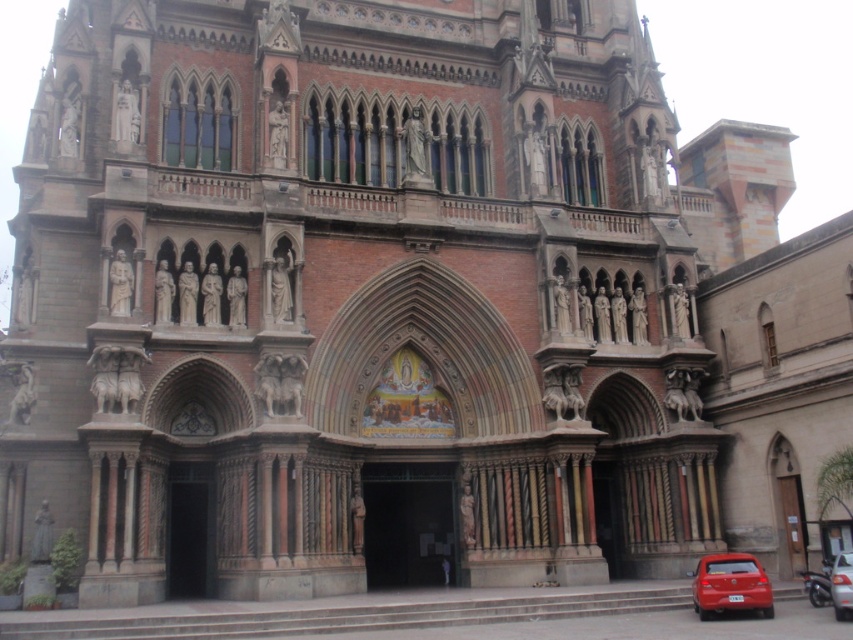
Question: Is metallic silver car at lower right wider than silver metallic car at lower right?

Choices:
 (A) yes
 (B) no

Answer: (A)

Question: Which object is the farthest from the metallic silver car at lower right?

Choices:
 (A) silver metallic car at lower right
 (B) shiny red car at lower right

Answer: (B)

Question: Which object appears closest to the camera in this image?

Choices:
 (A) silver metallic car at lower right
 (B) metallic silver car at lower right

Answer: (A)

Question: Based on their relative distances, which object is farther from the shiny red car at lower right?

Choices:
 (A) metallic silver car at lower right
 (B) silver metallic car at lower right

Answer: (A)

Question: Is shiny red car at lower right bigger than silver metallic car at lower right?

Choices:
 (A) no
 (B) yes

Answer: (B)

Question: Does shiny red car at lower right appear under metallic silver car at lower right?

Choices:
 (A) no
 (B) yes

Answer: (B)